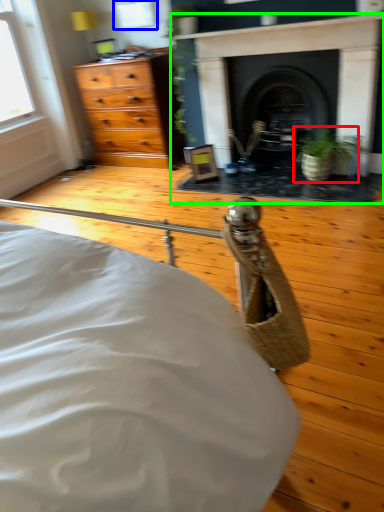
Question: Which object is the farthest from houseplant (highlighted by a red box)? Choose among these: window (highlighted by a blue box) or fireplace (highlighted by a green box).

Choices:
 (A) window
 (B) fireplace

Answer: (A)